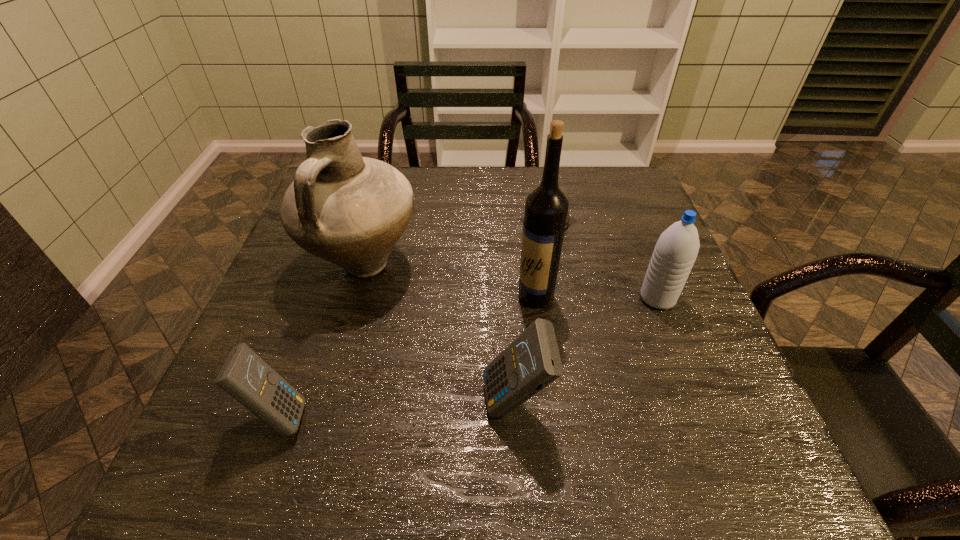
Where is `blank space that satisfies the following two spatial constraints: 1. on the front side of the third tallest object; 2. on the front-facing side of the shorter calculator`? blank space that satisfies the following two spatial constraints: 1. on the front side of the third tallest object; 2. on the front-facing side of the shorter calculator is located at coordinates (705, 416).

I want to click on vacant region that satisfies the following two spatial constraints: 1. on the front side of the third tallest object; 2. on the front-facing side of the right calculator, so click(x=699, y=403).